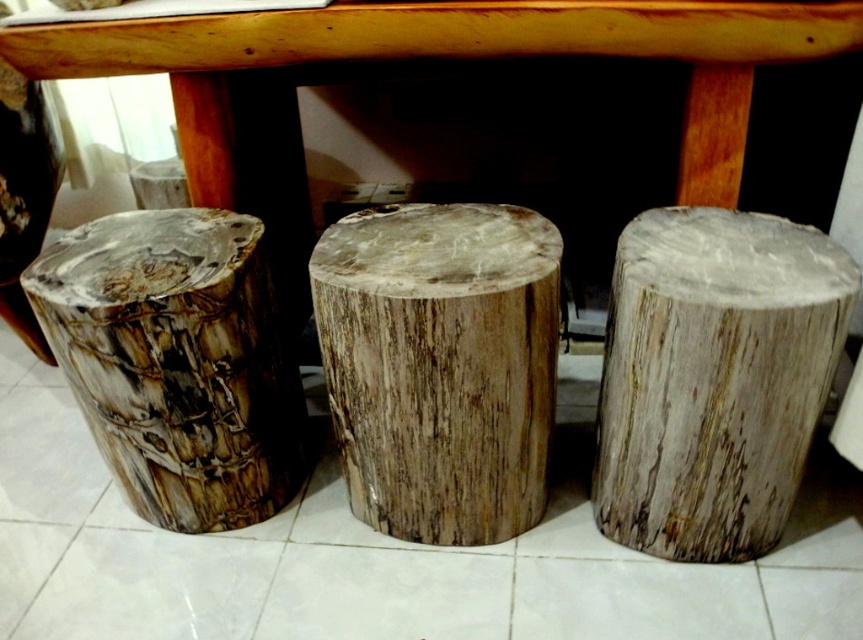
Question: Which point is farther to the camera?

Choices:
 (A) (61, 276)
 (B) (395, 520)
 (C) (763, 216)
 (D) (347, 36)

Answer: (B)

Question: Does natural wood stump at center lie behind wooden table at center?

Choices:
 (A) yes
 (B) no

Answer: (B)

Question: Based on their relative distances, which object is nearer to the natural wood stump at center?

Choices:
 (A) fossilized wood stump at left
 (B) wooden table at center

Answer: (A)

Question: Observing the image, what is the correct spatial positioning of natural wood stump at center in reference to fossilized wood stump at left?

Choices:
 (A) above
 (B) below

Answer: (B)

Question: Which object is farther from the camera taking this photo?

Choices:
 (A) natural wood stump at right
 (B) natural wood stump at center
 (C) fossilized wood stump at left
 (D) wooden table at center

Answer: (D)

Question: Does wooden table at center lie behind fossilized wood stump at left?

Choices:
 (A) no
 (B) yes

Answer: (B)